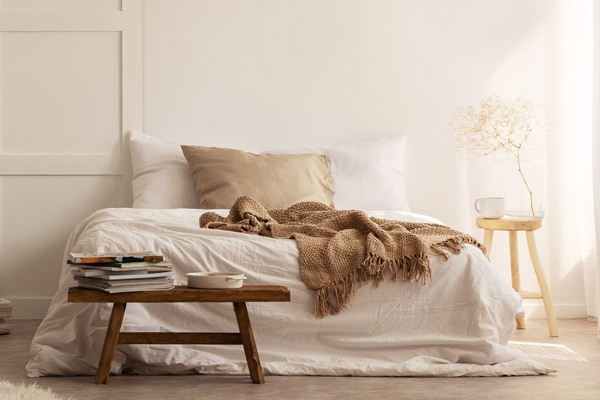
Find the location of `mug`. mug is located at coordinates (499, 201).